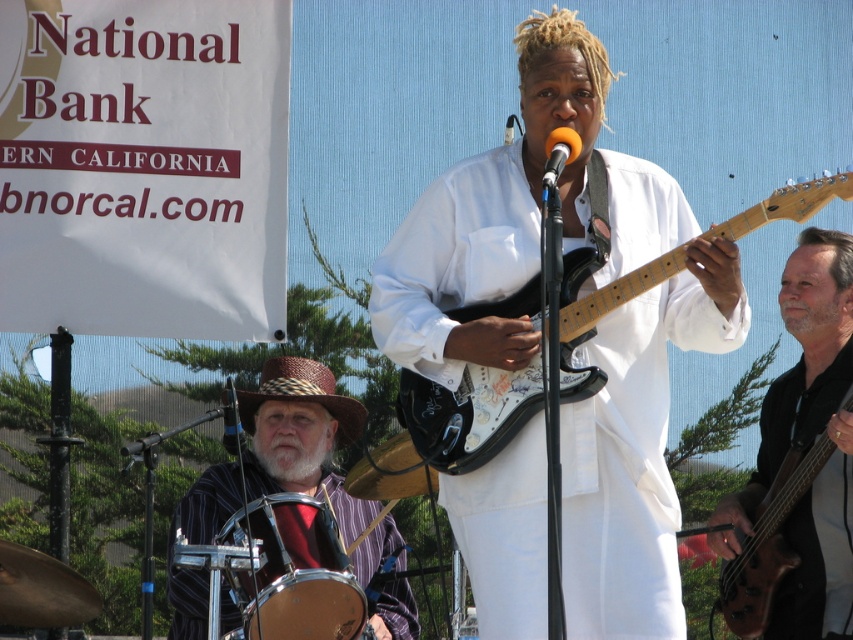
Consider the image. Who is higher up, white glossy electric guitar at center or shiny silver drum at lower left?

white glossy electric guitar at center is above.

Based on the photo, which of these two, white glossy electric guitar at center or shiny silver drum at lower left, stands shorter?

white glossy electric guitar at center

Between point (631, 280) and point (299, 500), which one is positioned behind?

Positioned behind is point (299, 500).

Locate an element on the screen. white glossy electric guitar at center is located at coordinates (467, 413).

Is point (596, 300) more distant than point (357, 413)?

No.

Is white glossy electric guitar at center to the left of striped fabric hat at left from the viewer's perspective?

No, white glossy electric guitar at center is not to the left of striped fabric hat at left.

The image size is (853, 640). Identify the location of white glossy electric guitar at center. (467, 413).

Which is in front, point (757, 220) or point (547, 170)?

Positioned in front is point (547, 170).

Which of these two, white glossy electric guitar at center or orange matte microphone at center, stands taller?

Standing taller between the two is orange matte microphone at center.

At what (x,y) coordinates should I click in order to perform the action: click on white glossy electric guitar at center. Please return your answer as a coordinate pair (x, y). The width and height of the screenshot is (853, 640). Looking at the image, I should click on (467, 413).